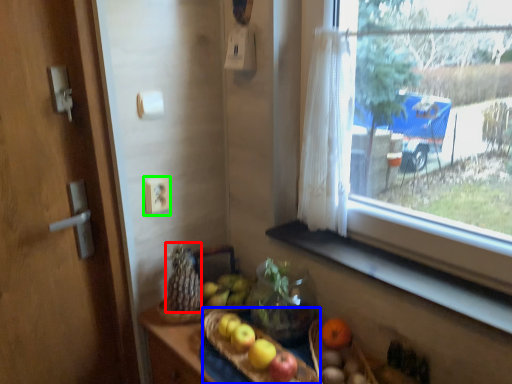
Question: Based on their relative distances, which object is nearer to food (highlighted by a red box)? Choose from basket (highlighted by a blue box) and electric outlet (highlighted by a green box).

Choices:
 (A) basket
 (B) electric outlet

Answer: (A)